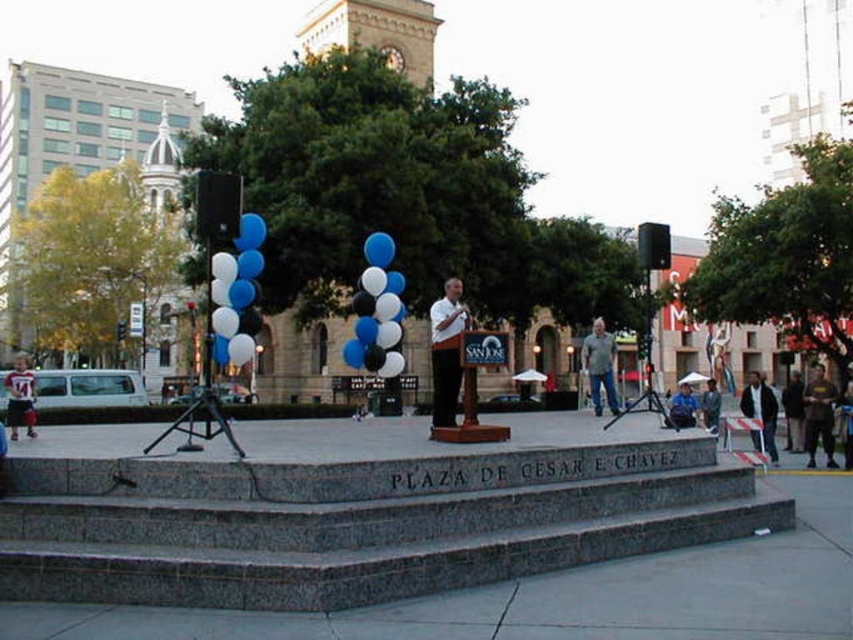
Question: Which of the following is the closest to the observer?

Choices:
 (A) (683, 426)
 (B) (828, 452)

Answer: (A)

Question: Estimate the real-world distances between objects in this image. Which object is farther from the white matte shirt at center?

Choices:
 (A) dark blue jeans at lower right
 (B) dark brown leather jacket at lower right
 (C) blue glossy balloons at center

Answer: (B)

Question: Can you confirm if blue glossy balloons at left is smaller than denim jeans at center?

Choices:
 (A) no
 (B) yes

Answer: (A)

Question: Can you confirm if blue glossy balloons at left is positioned to the right of white matte shirt at center?

Choices:
 (A) no
 (B) yes

Answer: (A)

Question: Among these points, which one is farthest from the camera?

Choices:
 (A) (833, 438)
 (B) (747, 492)

Answer: (A)

Question: Does dark gray hoodie at lower right have a greater width compared to dark blue jeans at lower right?

Choices:
 (A) yes
 (B) no

Answer: (B)